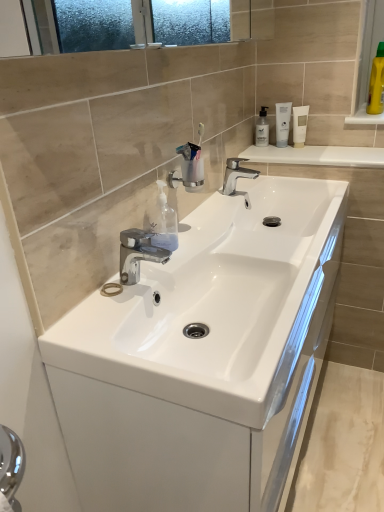
Find the location of `free location above white glossy countertop at upper center (from a real-world perspective)`. free location above white glossy countertop at upper center (from a real-world perspective) is located at coordinates (309, 149).